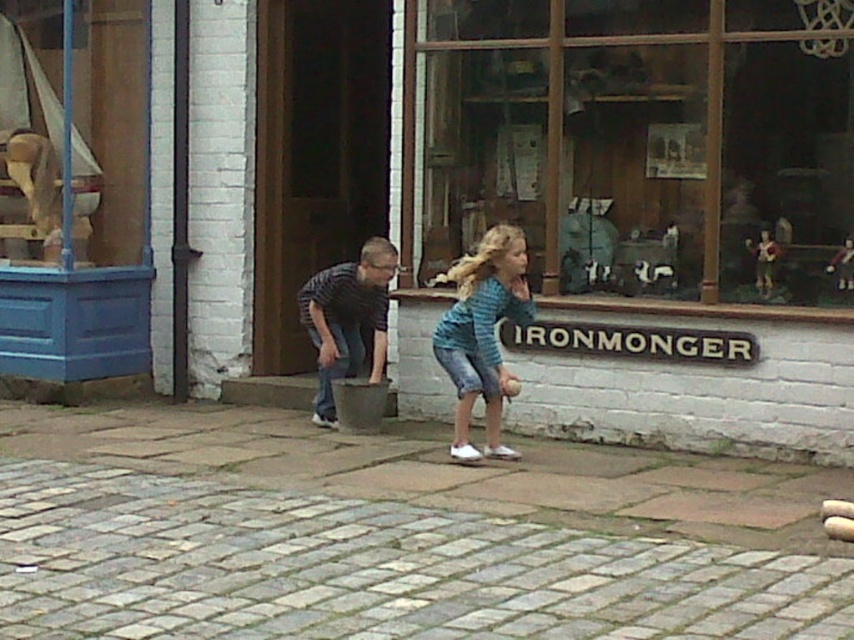
Question: Which point is closer to the camera taking this photo?

Choices:
 (A) (309, 333)
 (B) (478, 243)
 (C) (577, 596)

Answer: (C)

Question: Which of the following is the closest to the observer?

Choices:
 (A) (819, 294)
 (B) (303, 573)
 (C) (513, 243)
 (D) (370, 374)

Answer: (B)

Question: Is gray stone pavement at lower center to the left of blue striped shirt at center from the viewer's perspective?

Choices:
 (A) yes
 (B) no

Answer: (A)

Question: Is wooden display case at center below brushed metal bucket at center?

Choices:
 (A) yes
 (B) no

Answer: (B)

Question: Which object is positioned farthest from the gray stone pavement at lower center?

Choices:
 (A) blue striped shirt at center
 (B) wooden display case at center

Answer: (B)

Question: Can you confirm if gray stone pavement at lower center is positioned below brushed metal bucket at center?

Choices:
 (A) yes
 (B) no

Answer: (A)